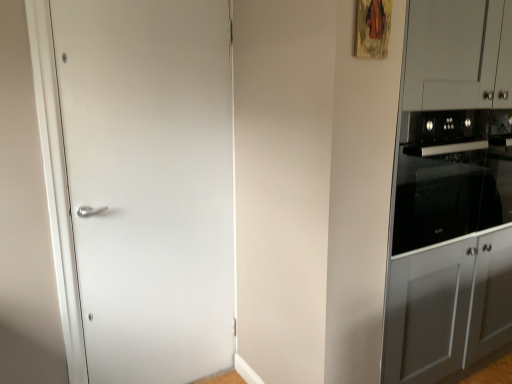
Question: From their relative heights in the image, would you say black glass oven at right is taller or shorter than satin gray cabinet at right?

Choices:
 (A) short
 (B) tall

Answer: (A)

Question: Looking at the image, does black glass oven at right seem bigger or smaller compared to satin gray cabinet at right?

Choices:
 (A) small
 (B) big

Answer: (A)

Question: Considering the real-world distances, which object is farthest from the black glass oven at right?

Choices:
 (A) satin gray cabinet at right
 (B) white matte door at left

Answer: (B)

Question: Which of these objects is positioned farthest from the satin gray cabinet at right?

Choices:
 (A) white matte door at left
 (B) black glass oven at right

Answer: (A)